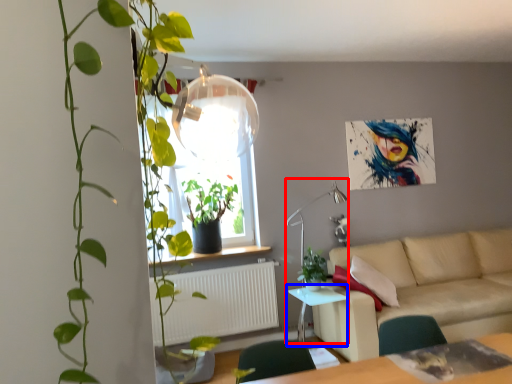
Question: Which object is closer to the camera taking this photo, lamp (highlighted by a red box) or table (highlighted by a blue box)?

Choices:
 (A) lamp
 (B) table

Answer: (B)